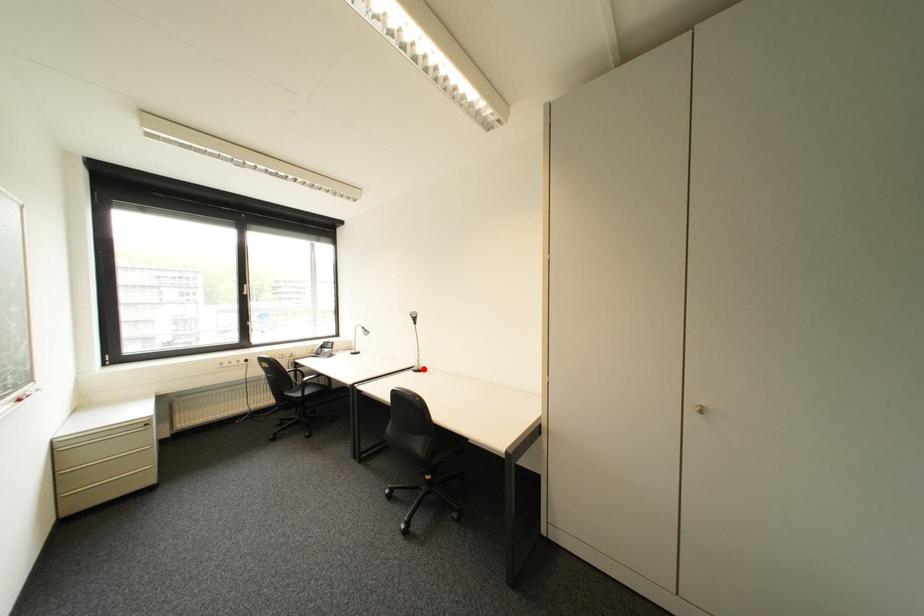
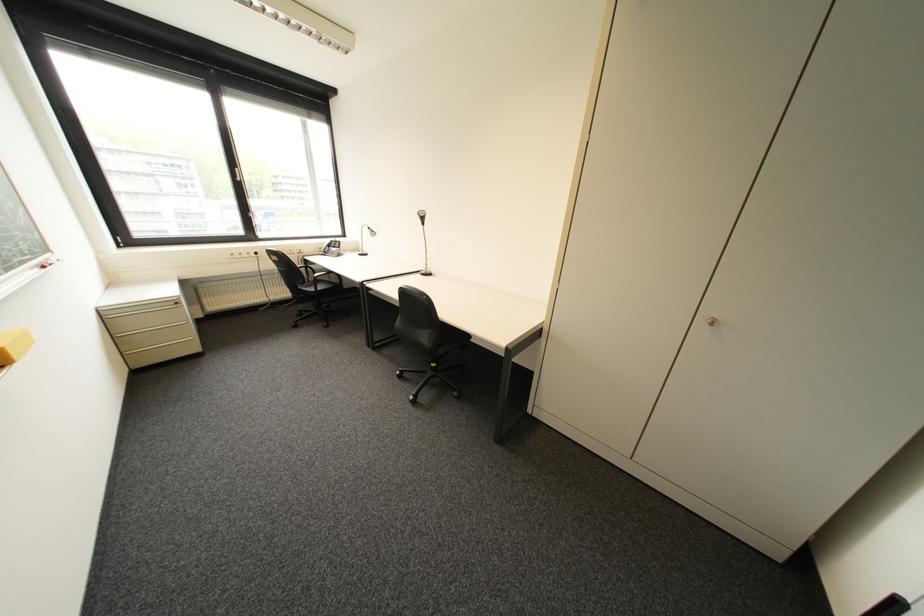
Question: I am providing you with two images of the same scene from different viewpoints. A red point is shown in image1. For the corresponding object point in image2, is it positioned nearer or farther from the camera?

Choices:
 (A) Nearer
 (B) Farther

Answer: (A)